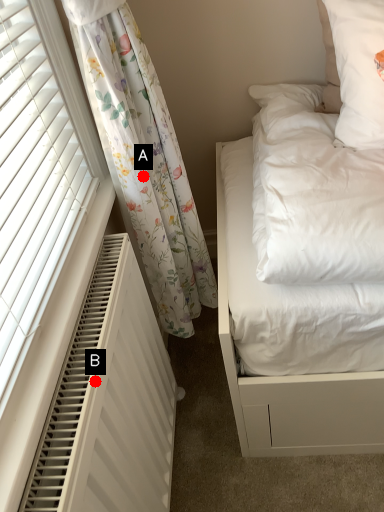
Question: Two points are circled on the image, labeled by A and B beside each circle. Which point is closer to the camera?

Choices:
 (A) A is closer
 (B) B is closer

Answer: (B)